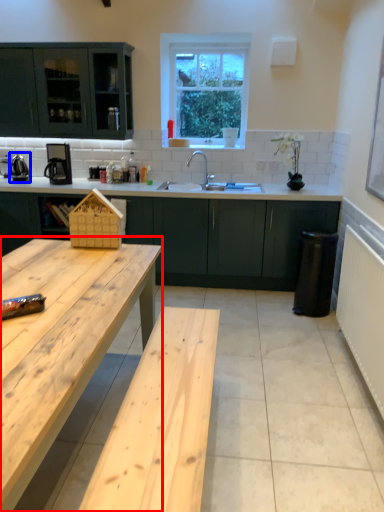
Question: Which object appears closest to the camera in this image, table (highlighted by a red box) or appliance (highlighted by a blue box)?

Choices:
 (A) table
 (B) appliance

Answer: (A)